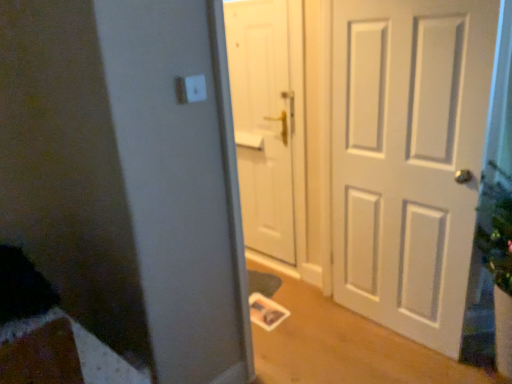
At what (x,y) coordinates should I click in order to perform the action: click on free location in front of white matte door at right, the first door positioned from the right. Please return your answer as a coordinate pair (x, y). Looking at the image, I should click on (399, 359).